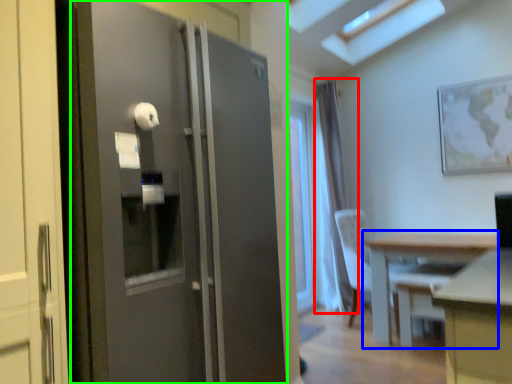
Question: Considering the real-world distances, which object is closest to curtain (highlighted by a red box)? table (highlighted by a blue box) or door (highlighted by a green box).

Choices:
 (A) table
 (B) door

Answer: (A)